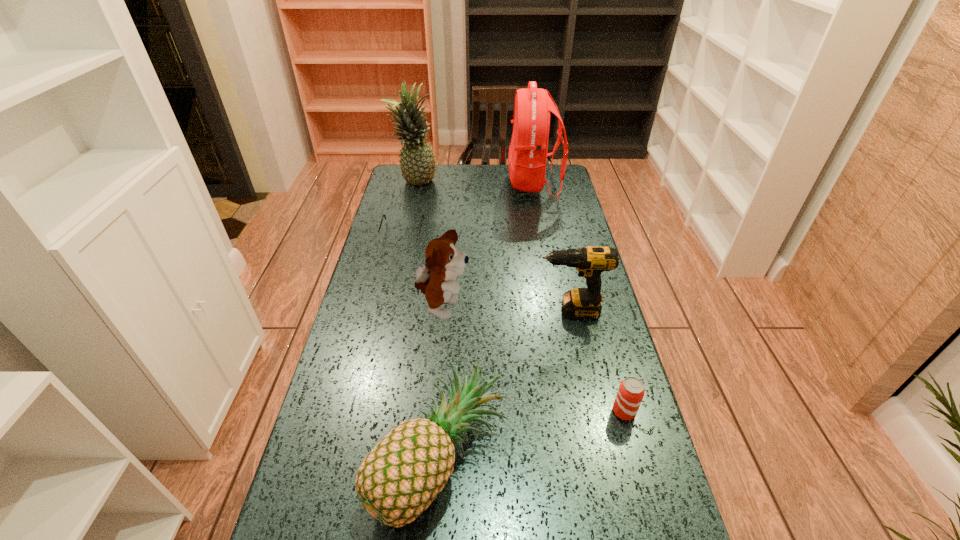
This screenshot has width=960, height=540. What are the coordinates of `vacant area between the fifth nearest object and the farther pineapple` in the screenshot? It's located at (409, 207).

Image resolution: width=960 pixels, height=540 pixels. I want to click on unoccupied area between the drill and the backpack, so click(552, 248).

Locate an element on the screen. This screenshot has height=540, width=960. free space between the fifth nearest object and the backpack is located at coordinates (468, 208).

The width and height of the screenshot is (960, 540). In order to click on free space between the drill and the farther pineapple in this screenshot , I will do `click(492, 247)`.

The height and width of the screenshot is (540, 960). I want to click on vacant area that lies between the spectacles and the backpack, so click(468, 208).

Locate an element on the screen. free spot between the backpack and the drill is located at coordinates 552,248.

Find the location of a particular element. The image size is (960, 540). blank region between the drill and the backpack is located at coordinates (552, 248).

Find the location of a particular element. This screenshot has height=540, width=960. object that is the closest to the beer can is located at coordinates pyautogui.click(x=397, y=481).

Locate an element on the screen. The height and width of the screenshot is (540, 960). the closest object relative to the spectacles is located at coordinates (417, 161).